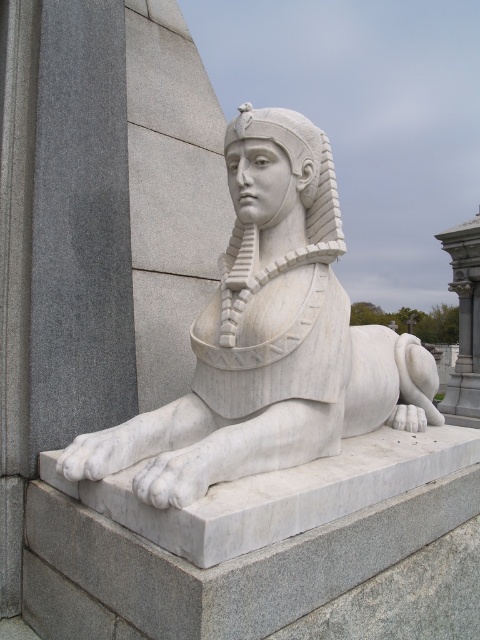
Question: Can you confirm if white marble sphinx at center is wider than white marble pillar at right?

Choices:
 (A) yes
 (B) no

Answer: (A)

Question: Can you confirm if white marble sphinx at center is positioned above white marble pillar at right?

Choices:
 (A) yes
 (B) no

Answer: (B)

Question: Can you confirm if white marble sphinx at center is wider than white marble pillar at right?

Choices:
 (A) yes
 (B) no

Answer: (A)

Question: Which point is farther to the camera?

Choices:
 (A) (454, 410)
 (B) (127, 428)

Answer: (A)

Question: Among these points, which one is nearest to the camera?

Choices:
 (A) (476, 358)
 (B) (284, 356)

Answer: (B)

Question: Which of the following is the farthest from the observer?

Choices:
 (A) (274, 212)
 (B) (477, 352)

Answer: (B)